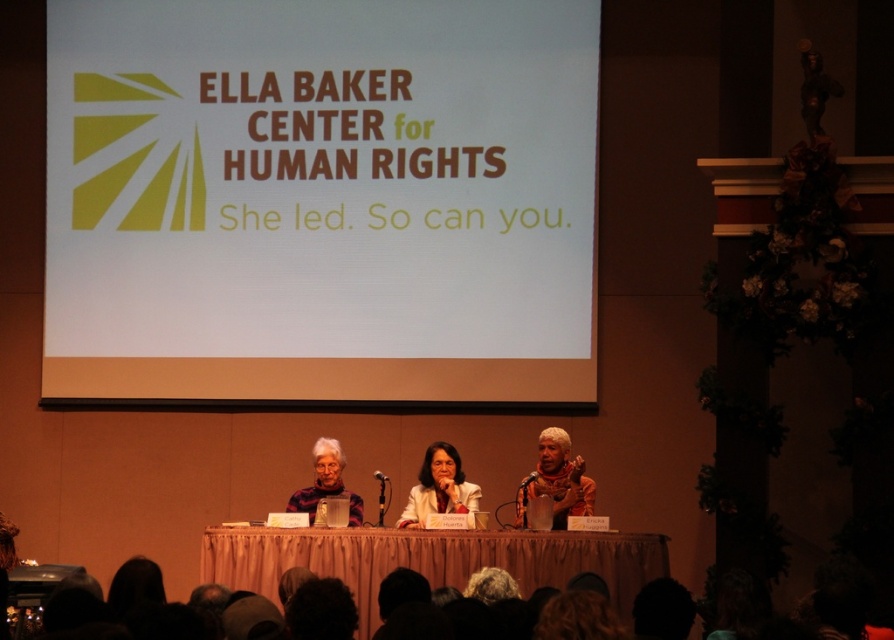
The image size is (894, 640). Describe the element at coordinates (557, 481) in the screenshot. I see `silky brown scarf at center` at that location.

Can you confirm if silky brown scarf at center is thinner than matte white shirt at center?

No.

The height and width of the screenshot is (640, 894). What do you see at coordinates (557, 481) in the screenshot?
I see `silky brown scarf at center` at bounding box center [557, 481].

I want to click on silky brown scarf at center, so click(x=557, y=481).

Is white paper at center above matte black sweater at center?

Yes, white paper at center is above matte black sweater at center.

Between white paper at center and matte black sweater at center, which one appears on the right side from the viewer's perspective?

matte black sweater at center is more to the right.

Between point (519, 109) and point (334, 445), which one is positioned behind?

The point (519, 109) is behind.

In order to click on white paper at center in this screenshot , I will do `click(319, 198)`.

Can you confirm if silky brown scarf at center is positioned to the left of matte black sweater at center?

No, silky brown scarf at center is not to the left of matte black sweater at center.

Which is more to the right, silky brown scarf at center or matte black sweater at center?

silky brown scarf at center is more to the right.

Is point (589, 490) behind point (302, 497)?

No, (589, 490) is in front of (302, 497).

This screenshot has width=894, height=640. Find the location of `silky brown scarf at center`. silky brown scarf at center is located at coordinates (557, 481).